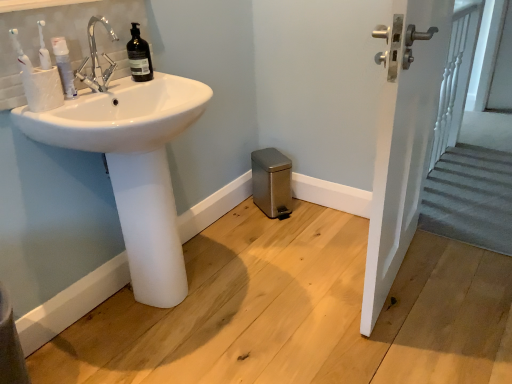
What do you see at coordinates (402, 138) in the screenshot? The width and height of the screenshot is (512, 384). I see `white glossy door handle at upper right` at bounding box center [402, 138].

What do you see at coordinates (42, 88) in the screenshot? The height and width of the screenshot is (384, 512). I see `white textured cup at left` at bounding box center [42, 88].

Identify the location of white textured cup at left. This screenshot has height=384, width=512. (42, 88).

The height and width of the screenshot is (384, 512). Describe the element at coordinates (64, 66) in the screenshot. I see `white matte toothpaste tube at left` at that location.

The height and width of the screenshot is (384, 512). What are the coordinates of `black matte bottle at upper left` in the screenshot? It's located at (139, 56).

In order to face black matte bottle at upper left, should I rotate leftwards or rightwards?

To align with it, rotate left about 15.466°.

At what (x,y) coordinates should I click in order to perform the action: click on satin silver trash can at lower center. Please return your answer as a coordinate pair (x, y). Looking at the image, I should click on (271, 182).

What are the coordinates of `white glossy sink at left` in the screenshot? It's located at (133, 167).

Which of these two, white textured cup at left or satin silver trash can at lower center, stands taller?

satin silver trash can at lower center is taller.

Is white textured cup at left with satin silver trash can at lower center?

No, white textured cup at left is not beside satin silver trash can at lower center.

You are a GUI agent. You are given a task and a screenshot of the screen. Output one action in this format:
    pyautogui.click(x=<x>, y=<y>)
    Task: Click on the toilet paper in front of the satin silver trash can at lower center
    
    Given the screenshot: What is the action you would take?
    pyautogui.click(x=42, y=88)

Consider the image. Which object is positioned more to the left, white textured cup at left or satin silver trash can at lower center?

Positioned to the left is white textured cup at left.

From their relative heights in the image, would you say white glossy sink at left is taller or shorter than satin silver trash can at lower center?

white glossy sink at left is taller than satin silver trash can at lower center.

Is white glossy sink at left in front of satin silver trash can at lower center?

Yes, white glossy sink at left is closer to the viewer.

From the image's perspective, is white glossy sink at left positioned above or below satin silver trash can at lower center?

From the image's perspective, white glossy sink at left appears below satin silver trash can at lower center.

Does white glossy door handle at upper right have a smaller size compared to white glossy sink at left?

Indeed, white glossy door handle at upper right has a smaller size compared to white glossy sink at left.

Considering the sizes of objects white glossy door handle at upper right and white glossy sink at left in the image provided, who is taller, white glossy door handle at upper right or white glossy sink at left?

white glossy door handle at upper right is taller.

Is white glossy door handle at upper right facing away from white glossy sink at left?

white glossy door handle at upper right does not have its back to white glossy sink at left.

What are the coordinates of `screen door in front of the white matte toothpaste tube at left` in the screenshot? It's located at (402, 138).

In the scene shown: Which is closer, (442, 8) or (56, 57)?

Point (442, 8) is positioned farther from the camera compared to point (56, 57).

Can you confirm if white glossy door handle at upper right is wider than white matte toothpaste tube at left?

Yes.

From the image's perspective, is white glossy door handle at upper right located above white matte toothpaste tube at left?

No, from the image's perspective, white glossy door handle at upper right is not on top of white matte toothpaste tube at left.

Considering the positions of objects white glossy sink at left and black matte bottle at upper left in the image provided, who is behind, white glossy sink at left or black matte bottle at upper left?

black matte bottle at upper left.

Does white glossy sink at left turn towards black matte bottle at upper left?

No, white glossy sink at left is not aimed at black matte bottle at upper left.

Between white glossy sink at left and black matte bottle at upper left, which one has smaller size?

With smaller size is black matte bottle at upper left.

Is white textured cup at left placed right next to white glossy sink at left?

No, white textured cup at left is not beside white glossy sink at left.

At what (x,y) coordinates should I click in order to perform the action: click on toilet paper positioned vertically above the white glossy sink at left (from a real-world perspective). Please return your answer as a coordinate pair (x, y). This screenshot has height=384, width=512. Looking at the image, I should click on (42, 88).

Is white textured cup at left positioned with its back to white glossy sink at left?

white textured cup at left is not turned away from white glossy sink at left.

Would you say white matte toothpaste tube at left is a long distance from satin silver trash can at lower center?

That's right, there is a large distance between white matte toothpaste tube at left and satin silver trash can at lower center.

Can you confirm if white matte toothpaste tube at left is smaller than satin silver trash can at lower center?

Correct, white matte toothpaste tube at left occupies less space than satin silver trash can at lower center.

Is white matte toothpaste tube at left further to camera compared to satin silver trash can at lower center?

No.

From the image's perspective, is white matte toothpaste tube at left located above or below satin silver trash can at lower center?

From the image's perspective, white matte toothpaste tube at left appears above satin silver trash can at lower center.

The width and height of the screenshot is (512, 384). What are the coordinates of `bidet below the white textured cup at left (from a real-world perspective)` in the screenshot? It's located at (271, 182).

At what (x,y) coordinates should I click in order to perform the action: click on bidet above the white glossy sink at left (from the image's perspective). Please return your answer as a coordinate pair (x, y). This screenshot has height=384, width=512. Looking at the image, I should click on (271, 182).

Consider the image. Estimate the real-world distances between objects in this image. Which object is further from white glossy sink at left, white glossy door handle at upper right or satin silver trash can at lower center?

Based on the image, satin silver trash can at lower center appears to be further to white glossy sink at left.

Based on their spatial positions, is white textured cup at left or satin silver trash can at lower center further from white matte toothpaste tube at left?

Based on the image, satin silver trash can at lower center appears to be further to white matte toothpaste tube at left.

When comparing their distances from white glossy door handle at upper right, does white glossy sink at left or black matte bottle at upper left seem closer?

white glossy sink at left lies closer to white glossy door handle at upper right than the other object.

From the image, which object appears to be farther from white textured cup at left, black matte bottle at upper left or white glossy sink at left?

black matte bottle at upper left lies further to white textured cup at left than the other object.

Looking at the image, which one is located further to white matte toothpaste tube at left, white textured cup at left or black matte bottle at upper left?

black matte bottle at upper left.

Looking at the image, which one is located further to white matte toothpaste tube at left, white glossy sink at left or white textured cup at left?

white glossy sink at left.

Which object lies further to the anchor point satin silver trash can at lower center, white glossy door handle at upper right or white textured cup at left?

white textured cup at left is further to satin silver trash can at lower center.

Based on the photo, looking at the image, which one is located further to white matte toothpaste tube at left, satin silver trash can at lower center or white glossy door handle at upper right?

Among the two, white glossy door handle at upper right is located further to white matte toothpaste tube at left.

Locate an element on the screen. This screenshot has height=384, width=512. toilet paper between white glossy sink at left and satin silver trash can at lower center in the front-back direction is located at coordinates (42, 88).

At what (x,y) coordinates should I click in order to perform the action: click on bottle located between white glossy sink at left and satin silver trash can at lower center in the depth direction. Please return your answer as a coordinate pair (x, y). The image size is (512, 384). Looking at the image, I should click on [139, 56].

You are a GUI agent. You are given a task and a screenshot of the screen. Output one action in this format:
    pyautogui.click(x=<x>, y=<y>)
    Task: Click on the toilet paper between white matte toothpaste tube at left and white glossy sink at left in the up-down direction
    This screenshot has width=512, height=384.
    Given the screenshot: What is the action you would take?
    pyautogui.click(x=42, y=88)

Find the location of a particular element. This screenshot has height=384, width=512. sink located between white matte toothpaste tube at left and white glossy door handle at upper right in the left-right direction is located at coordinates (133, 167).